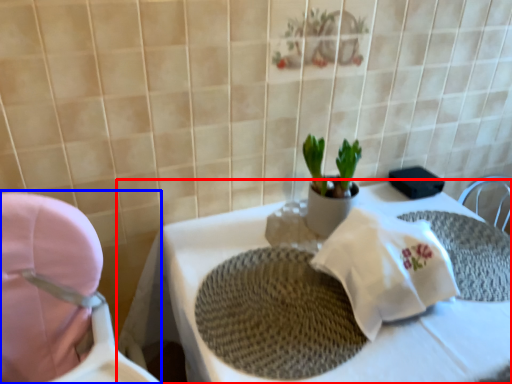
Question: Which point is closer to the camera, table (highlighted by a red box) or baby carriage (highlighted by a blue box)?

Choices:
 (A) table
 (B) baby carriage

Answer: (B)